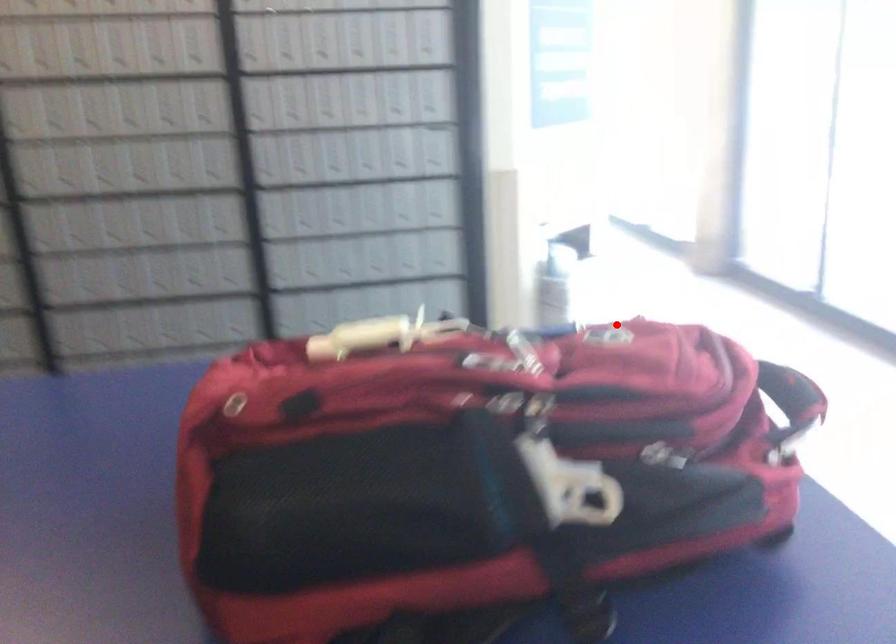
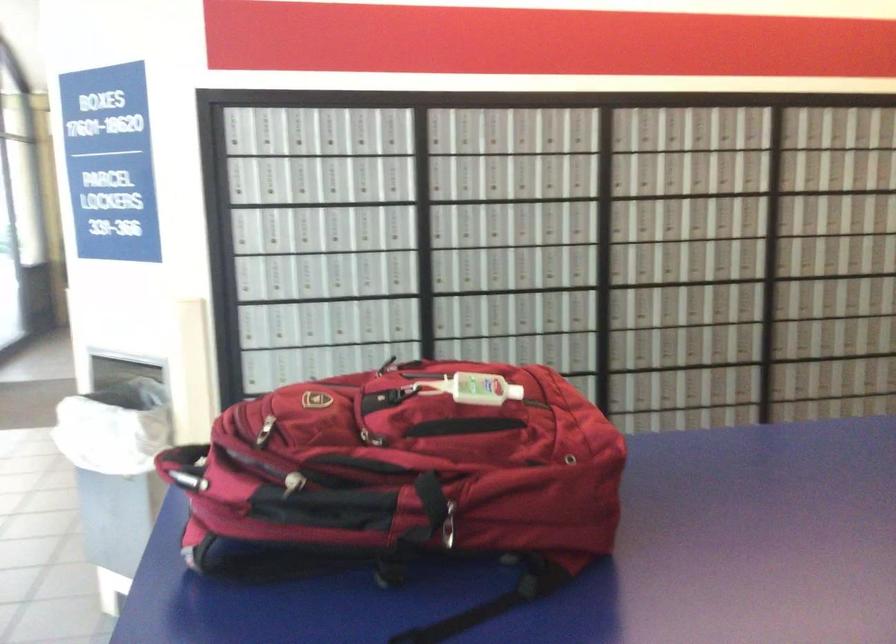
In the second image, find the point that corresponds to the highlighted location in the first image.

(264, 430)